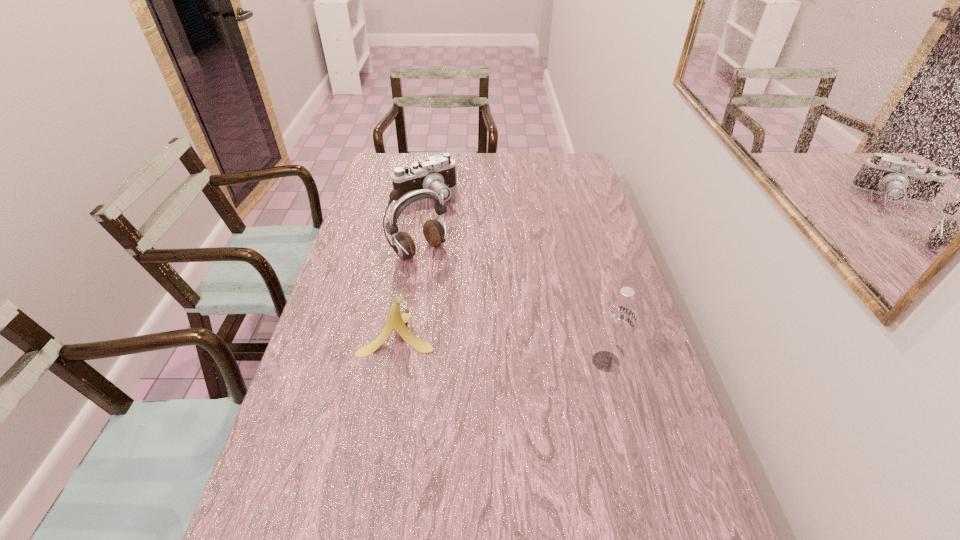
This screenshot has width=960, height=540. I want to click on free space at the far left corner of the desktop, so click(388, 166).

You are a GUI agent. You are given a task and a screenshot of the screen. Output one action in this format:
    pyautogui.click(x=<x>, y=<y>)
    Task: Click on the free spot at the far right corner of the desktop
    
    Given the screenshot: What is the action you would take?
    pyautogui.click(x=556, y=169)

This screenshot has width=960, height=540. Find the location of `free point between the vodka and the banana`. free point between the vodka and the banana is located at coordinates (502, 347).

Find the location of a particular element. unoccupied area between the farthest object and the vodka is located at coordinates (516, 279).

The height and width of the screenshot is (540, 960). What are the coordinates of `blank region between the rightmost object and the third nearest object` in the screenshot? It's located at (513, 306).

I want to click on vacant point located between the banana and the second farthest object, so click(409, 292).

Where is `free area in between the earphone and the farthest object`? The height and width of the screenshot is (540, 960). free area in between the earphone and the farthest object is located at coordinates click(x=423, y=223).

Find the location of `free space between the camera and the second farthest object`. free space between the camera and the second farthest object is located at coordinates (423, 223).

The height and width of the screenshot is (540, 960). What are the coordinates of `free space between the vodka and the banana` in the screenshot? It's located at [x=502, y=347].

Where is `blank region between the rightmost object and the banana`? The width and height of the screenshot is (960, 540). blank region between the rightmost object and the banana is located at coordinates (502, 347).